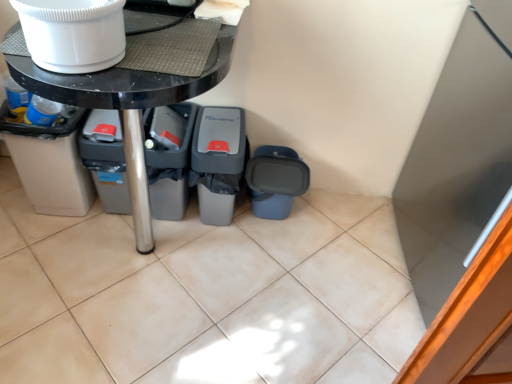
The width and height of the screenshot is (512, 384). Identify the location of free point in front of gray plastic bin at lower left. [x=104, y=239].